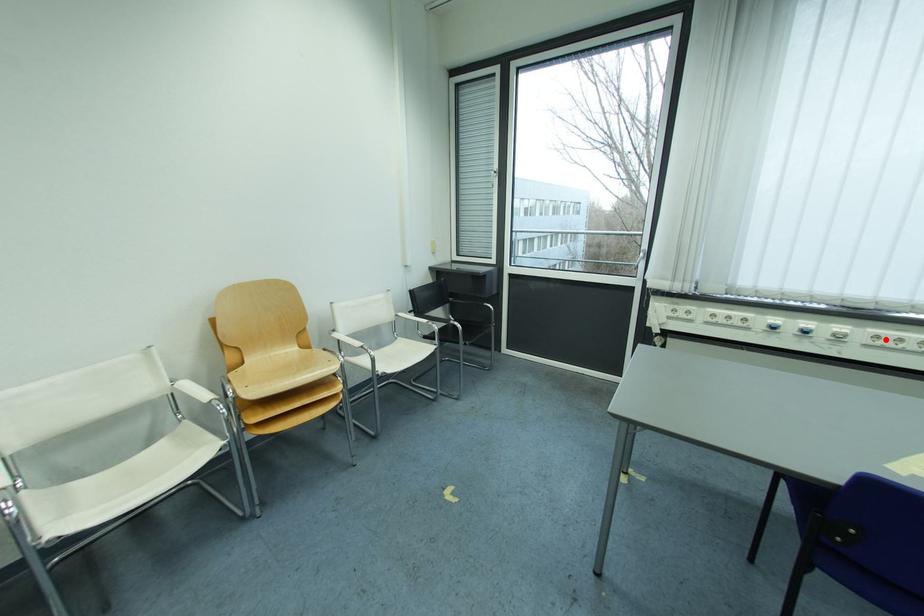
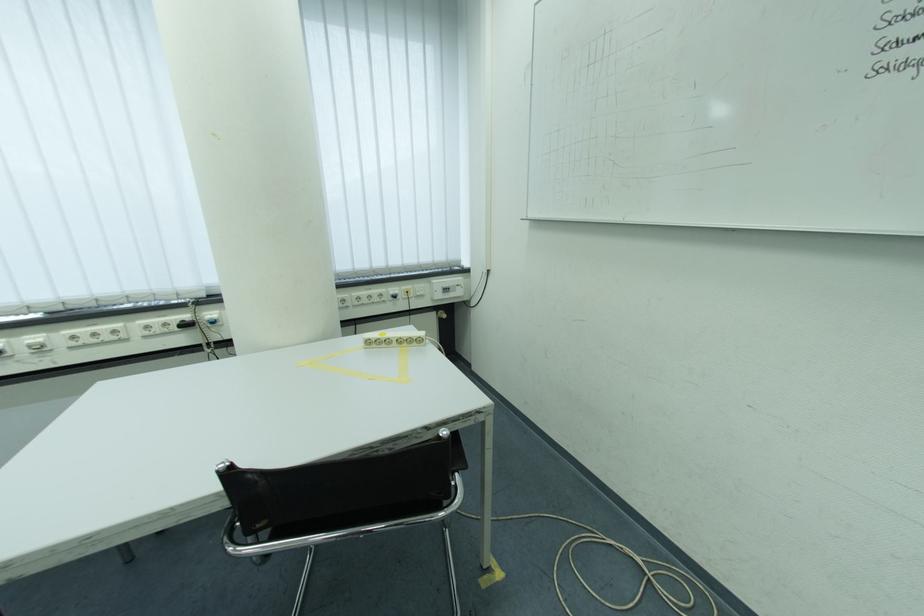
The point at the highlighted location is marked in the first image. Where is the corresponding point in the second image?

(82, 339)